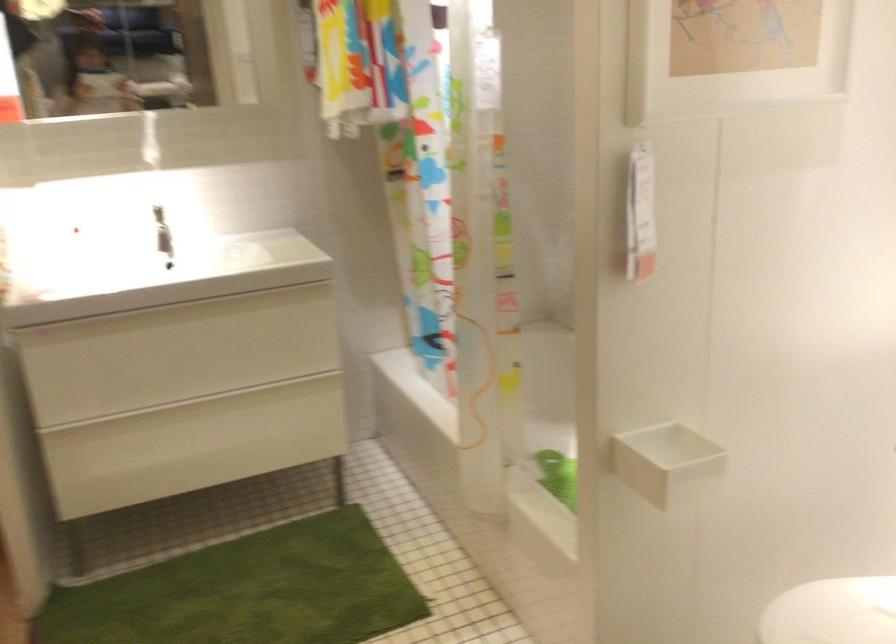
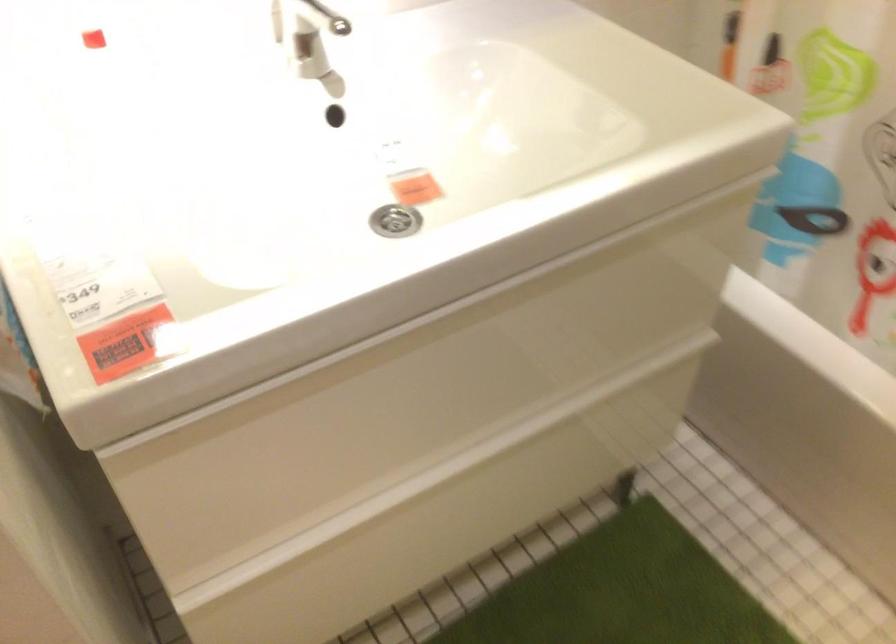
Find the pixel in the second image that matches (x=186, y=436) in the first image.

(442, 514)